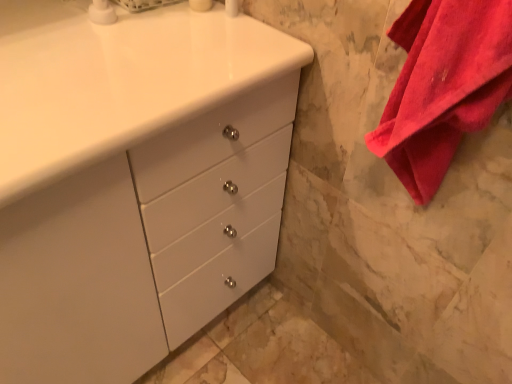
Locate an element on the screen. The width and height of the screenshot is (512, 384). vacant region to the left of white glossy soap dispenser at upper left is located at coordinates (47, 18).